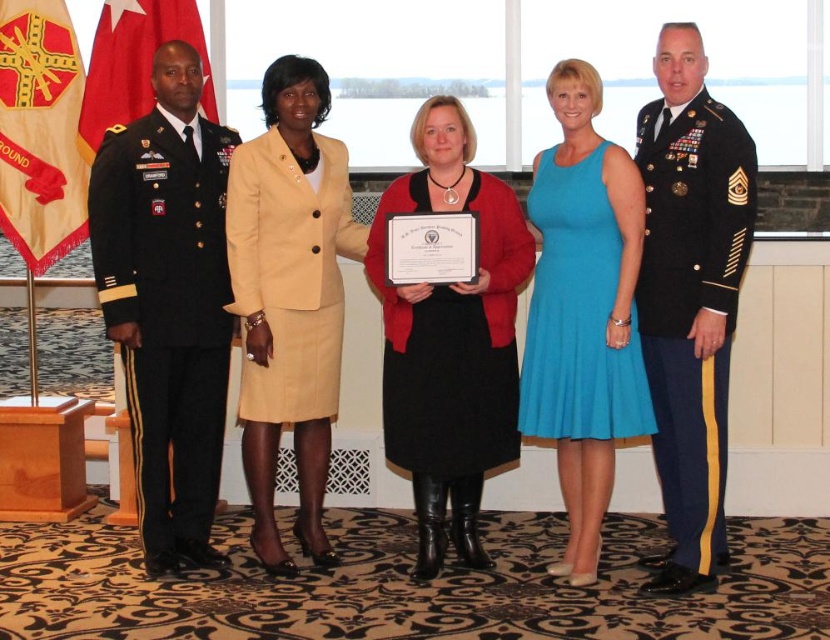
Based on the provided scene description, where is the turquoise fabric dress at center located in the image?

The turquoise fabric dress at center is located at point (583,310).

You are a photographer who needs to adjust the camera to capture all five people in the group photo. The camera has a focal length of 50mm. Knowing that the minimum distance between subjects for clear focus at this focal length is 10 feet, will the current spacing between the turquoise fabric dress at center and the other subjects allow for a sharp image of everyone?

The subjects are 14.60 feet apart, which exceeds the minimum required distance of 10 feet for clear focus at 50mm. Therefore, the current spacing between the turquoise fabric dress at center and the other subjects allows for a sharp image of everyone.